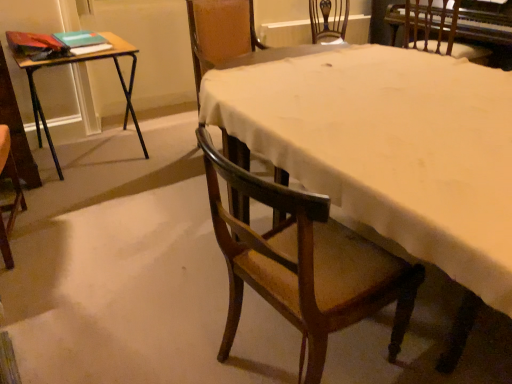
Question: Should I look upward or downward to see wooden folding table at left?

Choices:
 (A) up
 (B) down

Answer: (A)

Question: Should I look upward or downward to see wooden chair at center, acting as the 1th chair starting from the left?

Choices:
 (A) down
 (B) up

Answer: (B)

Question: Can you confirm if wooden folding table at left is positioned to the right of wooden chair at center, acting as the 1th chair starting from the left?

Choices:
 (A) no
 (B) yes

Answer: (A)

Question: Can you confirm if wooden folding table at left is shorter than wooden chair at center, which is counted as the third chair, starting from the right?

Choices:
 (A) yes
 (B) no

Answer: (A)

Question: From the image's perspective, is wooden folding table at left located beneath wooden chair at center, acting as the 1th chair starting from the left?

Choices:
 (A) no
 (B) yes

Answer: (B)

Question: Is wooden folding table at left behind wooden chair at center, the 2th chair when ordered from front to back?

Choices:
 (A) yes
 (B) no

Answer: (B)

Question: Is wooden folding table at left completely or partially outside of wooden chair at center, the 2th chair when ordered from front to back?

Choices:
 (A) yes
 (B) no

Answer: (A)

Question: Does wooden folding table at left appear on the left side of wooden chair at center, acting as the 1th chair starting from the left?

Choices:
 (A) yes
 (B) no

Answer: (A)

Question: Is wooden chair at lower right, the third chair viewed from the back, smaller than green matte book at upper left, which ranks as the first book in top-to-bottom order?

Choices:
 (A) no
 (B) yes

Answer: (A)

Question: Is wooden chair at lower right, the second chair viewed from the right, completely or partially outside of green matte book at upper left, which is the second book from bottom to top?

Choices:
 (A) yes
 (B) no

Answer: (A)

Question: Is the position of wooden chair at lower right, the second chair viewed from the right, less distant than that of green matte book at upper left, which ranks as the first book in top-to-bottom order?

Choices:
 (A) no
 (B) yes

Answer: (B)

Question: Considering the relative positions of wooden chair at lower right, the third chair viewed from the back, and green matte book at upper left, which ranks as the first book in top-to-bottom order, in the image provided, is wooden chair at lower right, the third chair viewed from the back, to the right of green matte book at upper left, which ranks as the first book in top-to-bottom order, from the viewer's perspective?

Choices:
 (A) no
 (B) yes

Answer: (B)

Question: Is green matte book at upper left, which is the second book from bottom to top, located within wooden chair at lower right, marked as the 2th chair in a left-to-right arrangement?

Choices:
 (A) no
 (B) yes

Answer: (A)

Question: Can you confirm if wooden chair at lower right, which appears as the first chair when viewed from the front, is wider than green matte book at upper left, which is the second book from bottom to top?

Choices:
 (A) yes
 (B) no

Answer: (A)

Question: From the image's perspective, is wooden folding table at left above white cloth at center?

Choices:
 (A) yes
 (B) no

Answer: (A)